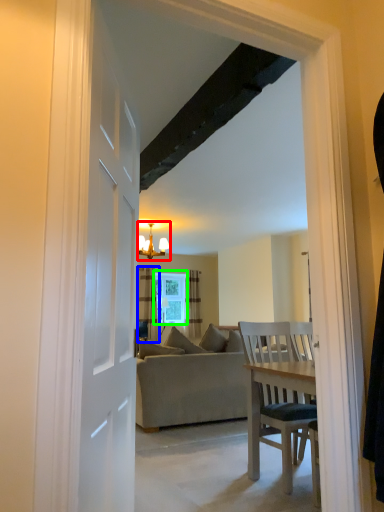
Question: Which is farther away from light fixture (highlighted by a red box)? curtain (highlighted by a blue box) or window (highlighted by a green box)?

Choices:
 (A) curtain
 (B) window

Answer: (B)